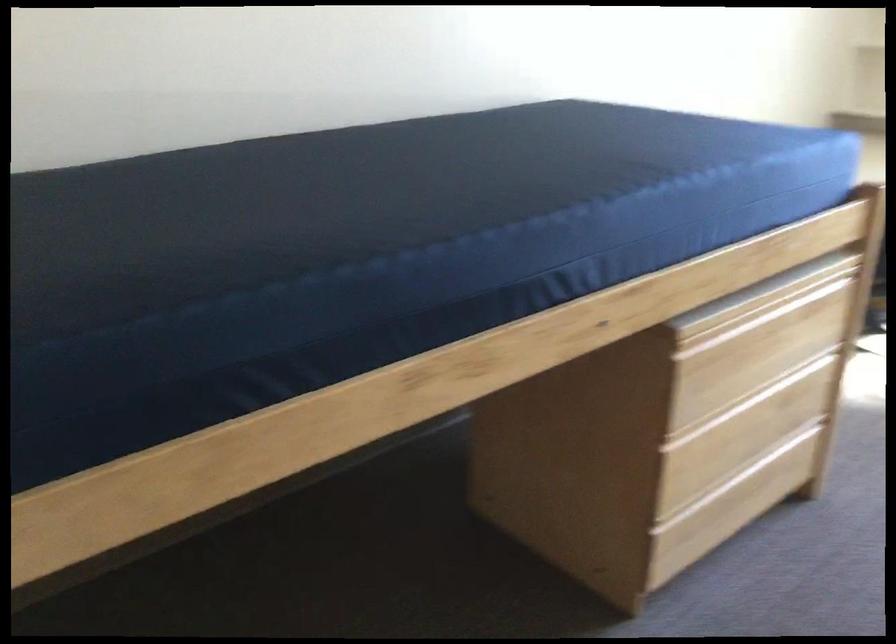
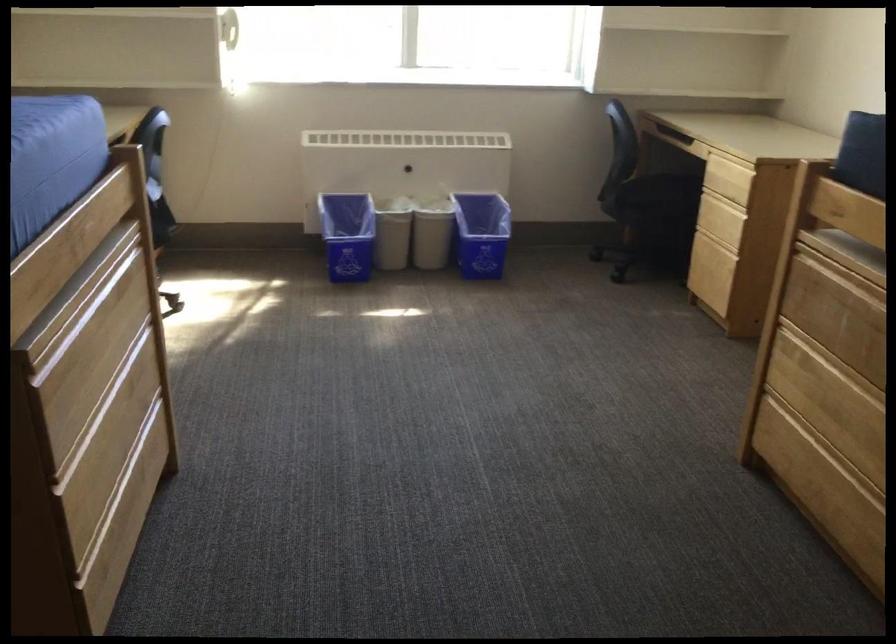
Question: The images are taken continuously from a first-person perspective. In which direction is your viewpoint rotating?

Choices:
 (A) Left
 (B) Right
 (C) Up
 (D) Down

Answer: (B)